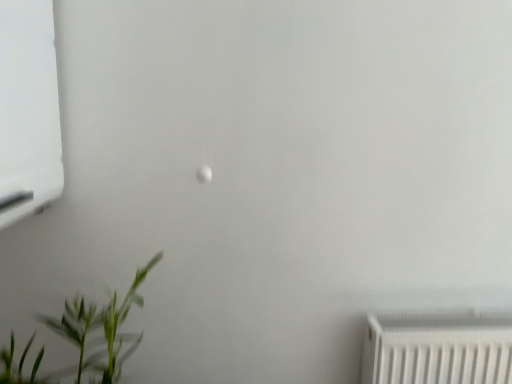
The image size is (512, 384). I want to click on green leafy plant at lower left, so click(84, 339).

Image resolution: width=512 pixels, height=384 pixels. What do you see at coordinates (84, 339) in the screenshot? I see `green leafy plant at lower left` at bounding box center [84, 339].

The width and height of the screenshot is (512, 384). Identify the location of green leafy plant at lower left. (84, 339).